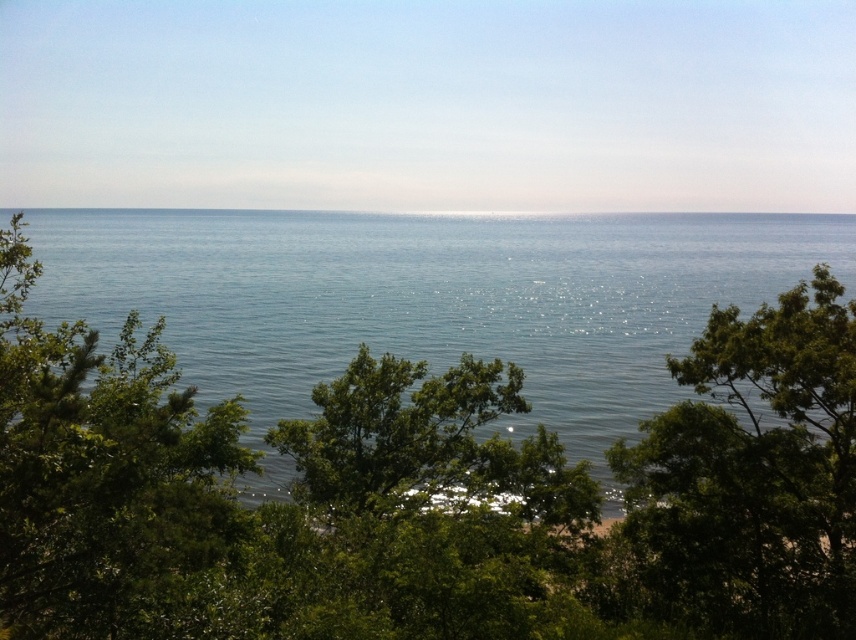
Does clear blue water at center lie in front of green leafy tree at center?

Yes.

Where is `clear blue water at center`? The image size is (856, 640). clear blue water at center is located at coordinates (429, 298).

Does point (125, 268) come closer to viewer compared to point (49, 483)?

No, it is behind (49, 483).

The image size is (856, 640). Describe the element at coordinates (429, 298) in the screenshot. I see `clear blue water at center` at that location.

The image size is (856, 640). Identify the location of clear blue water at center. (429, 298).

Who is more distant from viewer, (183, 464) or (828, 509)?

The point (828, 509) is more distant.

Which of these two, green leafy tree at left or green leafy tree at center, stands taller?

green leafy tree at left

Between point (117, 561) and point (830, 387), which one is positioned behind?

The point (830, 387) is behind.

This screenshot has height=640, width=856. I want to click on green leafy tree at left, so click(x=103, y=474).